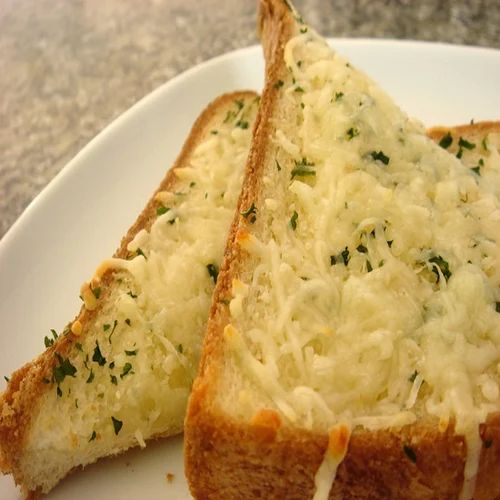
In order to click on counter top in this screenshot , I will do `click(105, 81)`.